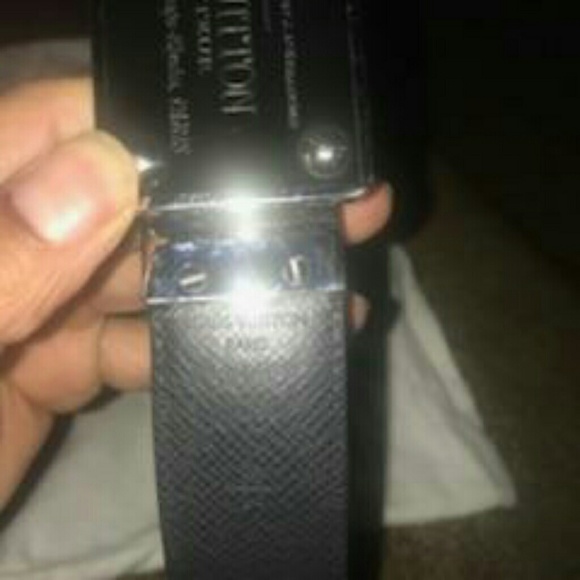
The height and width of the screenshot is (580, 580). Find the location of `pillow`. pillow is located at coordinates (430, 427), (101, 473).